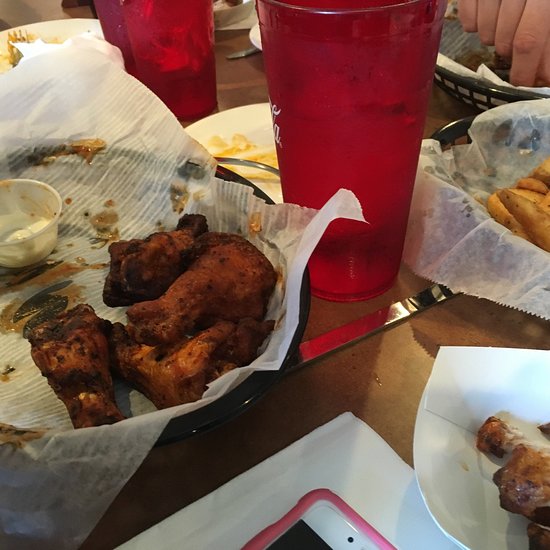
This screenshot has height=550, width=550. In order to click on part of a butter knife in this screenshot , I will do `click(395, 319)`.